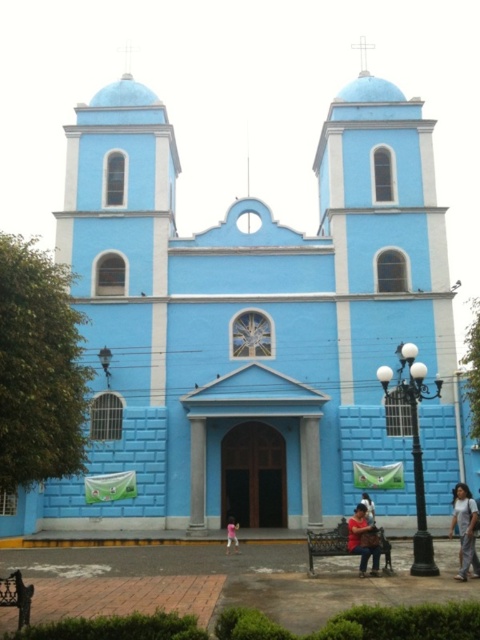
You are standing in front of the blue church with white accents. You notice two items at the center of the scene. Which item is closer to you, the matte black jacket at center or the pink fabric at center?

The matte black jacket at center is closer to you because it is in front of the pink fabric at center.

You are a photographer planning to capture the church and its surroundings. You notice the denim pants at lower right and the pink fabric at center. Which object should you focus on if you want to include the larger one in your shot?

The denim pants at lower right is larger in size than the pink fabric at center, so you should focus on the denim pants at lower right to include the larger one in your shot.

You are standing in front of the blue church with white accents. You notice two points marked on the ground in front of the church. The first point is at coordinates point (371, 529) and the second is at point (236, 528). If you were to walk from the church entrance towards these points, which point would you reach first?

Point (371, 529) is closer to the viewer than point (236, 528), so you would reach point (371, 529) first.